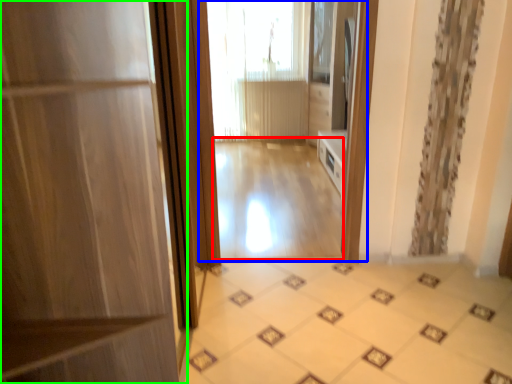
Question: Considering the real-world distances, which object is farthest from corridor (highlighted by a red box)? residence (highlighted by a blue box) or door (highlighted by a green box)?

Choices:
 (A) residence
 (B) door

Answer: (B)